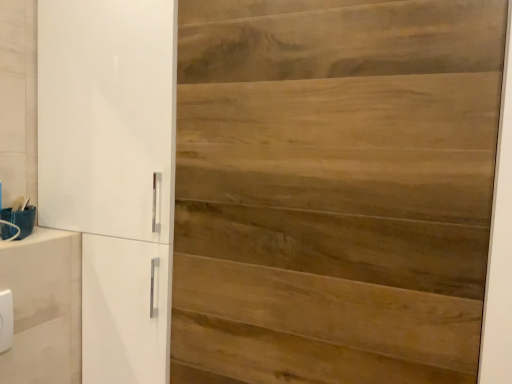
Question: From a real-world perspective, is white plastic/light switch at lower left under wooden door at center?

Choices:
 (A) yes
 (B) no

Answer: (A)

Question: Does white plastic/light switch at lower left have a lesser width compared to wooden door at center?

Choices:
 (A) yes
 (B) no

Answer: (B)

Question: Is white plastic/light switch at lower left to the right of wooden door at center from the viewer's perspective?

Choices:
 (A) no
 (B) yes

Answer: (A)

Question: Is white plastic/light switch at lower left not inside wooden door at center?

Choices:
 (A) no
 (B) yes

Answer: (B)

Question: Is white plastic/light switch at lower left at the left side of wooden door at center?

Choices:
 (A) yes
 (B) no

Answer: (A)

Question: Looking at their shapes, would you say wooden door at center is wider or thinner than white plastic/light switch at lower left?

Choices:
 (A) wide
 (B) thin

Answer: (B)

Question: Is wooden door at center in front of or behind white plastic/light switch at lower left in the image?

Choices:
 (A) front
 (B) behind

Answer: (A)

Question: Is point (289, 345) positioned closer to the camera than point (5, 299)?

Choices:
 (A) closer
 (B) farther

Answer: (A)

Question: Would you say wooden door at center is to the left or to the right of white plastic/light switch at lower left in the picture?

Choices:
 (A) left
 (B) right

Answer: (B)

Question: In terms of width, does white glossy cupboard at left look wider or thinner when compared to wooden door at center?

Choices:
 (A) wide
 (B) thin

Answer: (A)

Question: Considering their positions, is white glossy cupboard at left located in front of or behind wooden door at center?

Choices:
 (A) behind
 (B) front

Answer: (A)

Question: Visually, is white glossy cupboard at left positioned to the left or to the right of wooden door at center?

Choices:
 (A) right
 (B) left

Answer: (B)

Question: Looking at the image, does white glossy cupboard at left seem bigger or smaller compared to wooden door at center?

Choices:
 (A) small
 (B) big

Answer: (B)

Question: Looking at the image, does white plastic/light switch at lower left seem bigger or smaller compared to white glossy cupboard at left?

Choices:
 (A) big
 (B) small

Answer: (B)

Question: In terms of height, does white plastic/light switch at lower left look taller or shorter compared to white glossy cupboard at left?

Choices:
 (A) tall
 (B) short

Answer: (B)